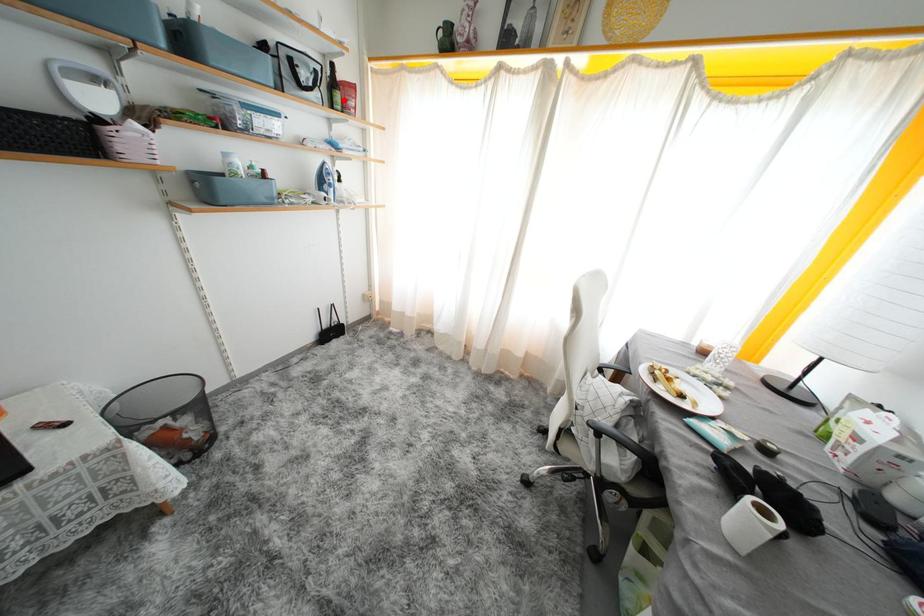
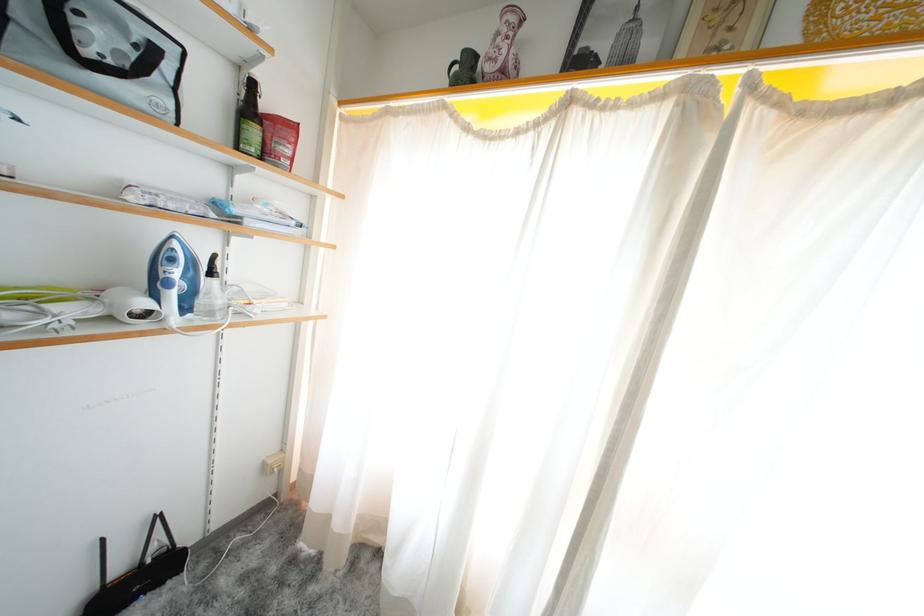
The point at the highlighted location is marked in the first image. Where is the corresponding point in the second image?

(261, 137)